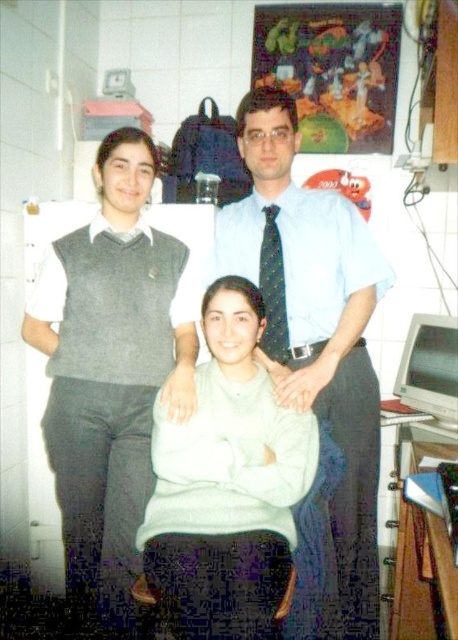
Is light blue shirt at center positioned behind light gray sweater at center?

Yes, it is behind light gray sweater at center.

Is point (352, 417) positioned in front of point (261, 584)?

No, it is behind (261, 584).

Is point (332, 531) less distant than point (238, 522)?

No, (332, 531) is behind (238, 522).

Find the location of a particular element. This screenshot has width=458, height=640. light blue shirt at center is located at coordinates (317, 332).

Does light blue shirt at center come behind black dotted tie at center?

No, light blue shirt at center is in front of black dotted tie at center.

Can you confirm if light blue shirt at center is smaller than black dotted tie at center?

No, light blue shirt at center is not smaller than black dotted tie at center.

Is point (333, 280) more distant than point (267, 280)?

No.

Locate an element on the screen. light blue shirt at center is located at coordinates (317, 332).

Does gray wool sweater vest at left have a lesser height compared to light blue shirt at center?

Yes.

Is point (85, 348) farther from camera compared to point (217, 237)?

That is False.

You are a GUI agent. You are given a task and a screenshot of the screen. Output one action in this format:
    pyautogui.click(x=<x>, y=<y>)
    Task: Click on the gray wool sweater vest at left
    This screenshot has height=640, width=458.
    Given the screenshot: What is the action you would take?
    pyautogui.click(x=109, y=369)